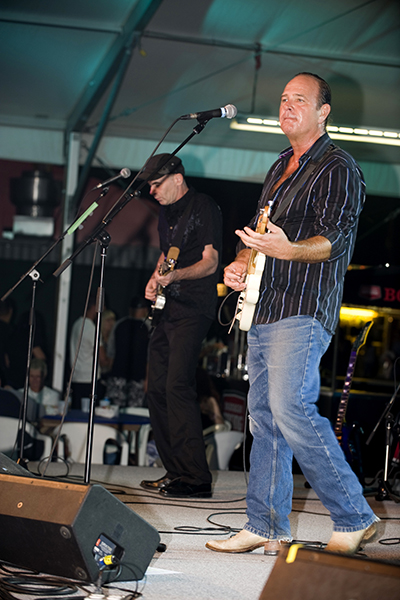
Where is `ceiling`? The image size is (400, 600). ceiling is located at coordinates (184, 57).